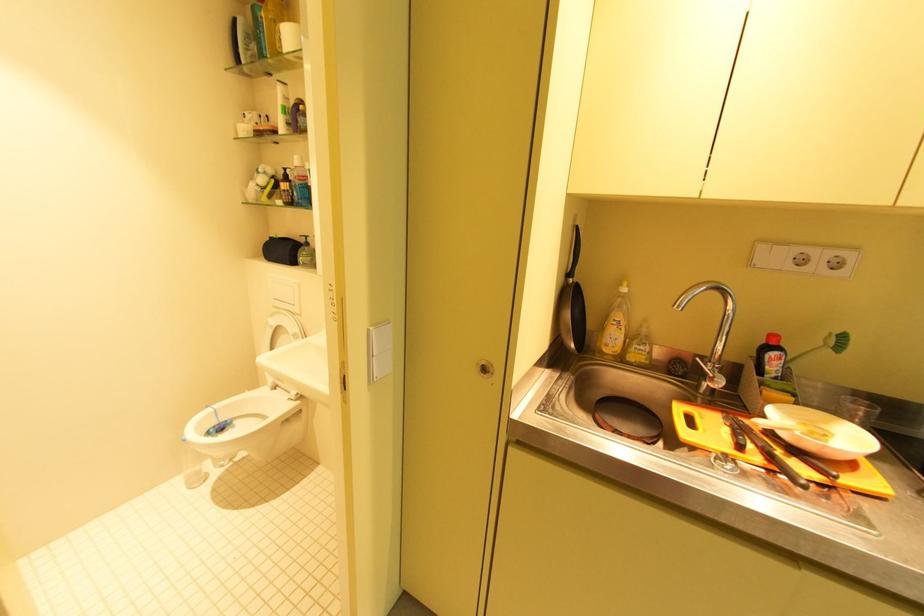
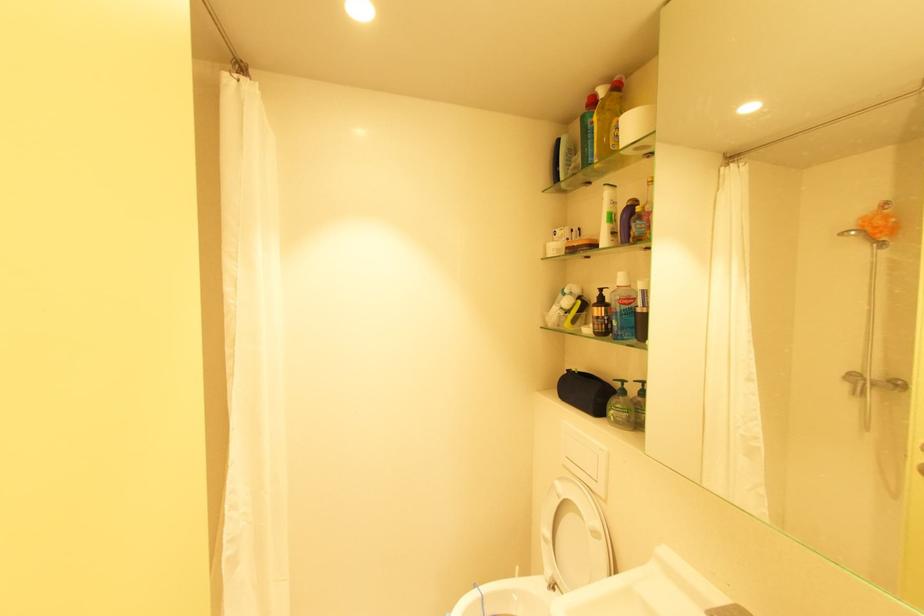
In the second image, find the point that corresponds to (280,300) in the first image.

(572, 458)